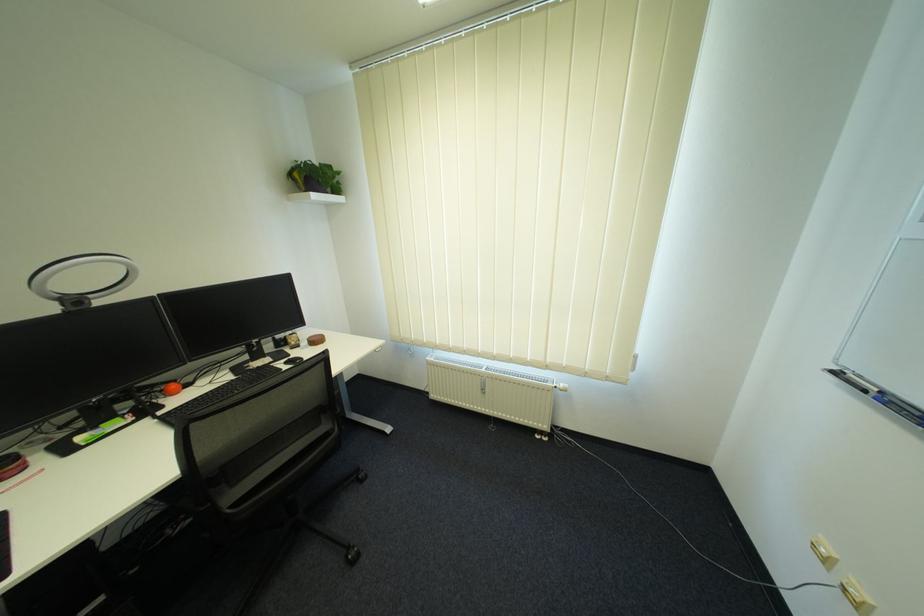
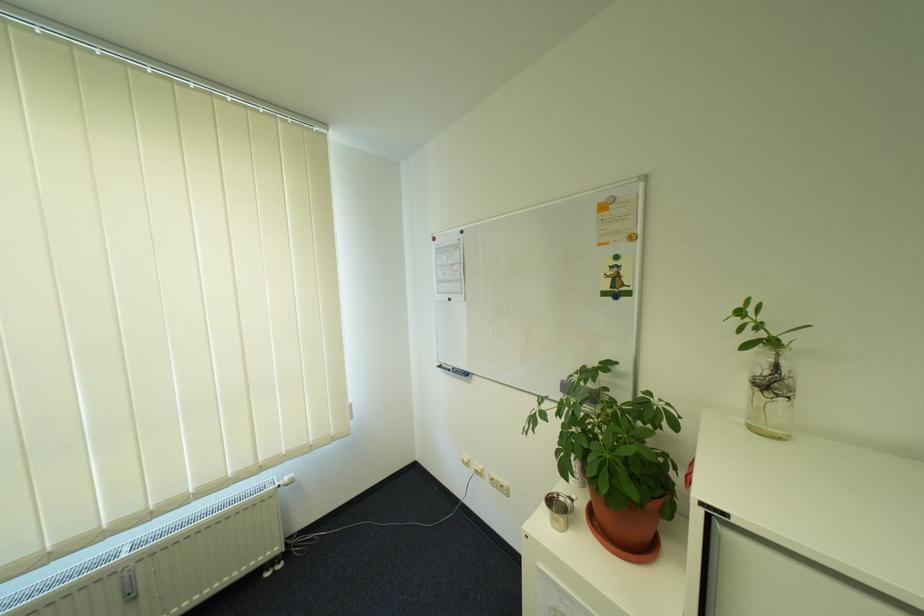
Question: How did the camera likely rotate?

Choices:
 (A) Left
 (B) Right
 (C) Up
 (D) Down

Answer: (B)